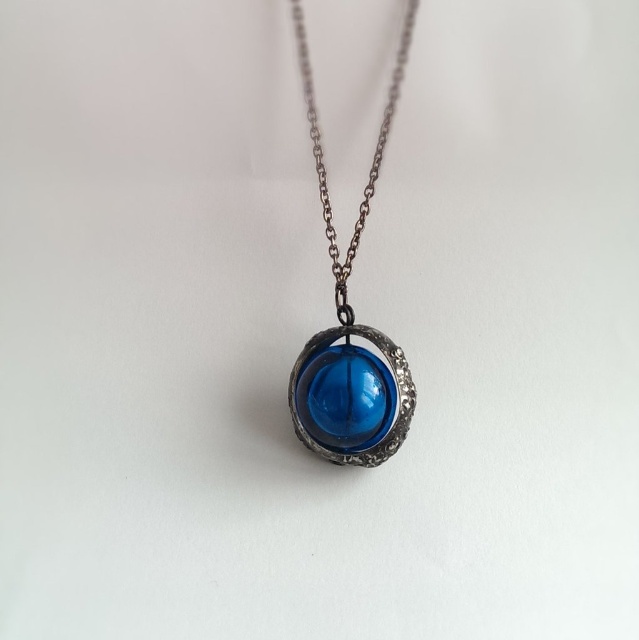
Question: Can you confirm if transparent glass sphere at center is wider than gunmetal chain at center?

Choices:
 (A) yes
 (B) no

Answer: (A)

Question: Can you confirm if transparent glass sphere at center is smaller than gunmetal chain at center?

Choices:
 (A) no
 (B) yes

Answer: (B)

Question: Which point is closer to the camera?

Choices:
 (A) gunmetal chain at center
 (B) transparent glass sphere at center

Answer: (B)

Question: Can you confirm if transparent glass sphere at center is positioned above gunmetal chain at center?

Choices:
 (A) yes
 (B) no

Answer: (B)